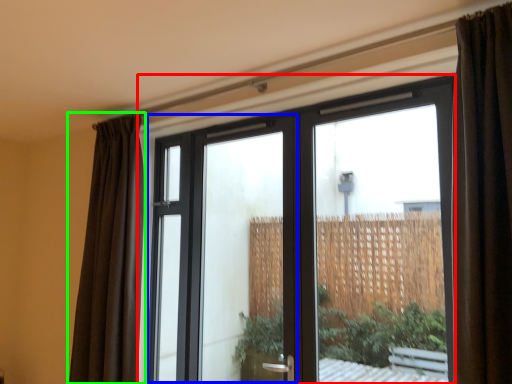
Question: Estimate the real-world distances between objects in this image. Which object is closer to window (highlighted by a red box), screen door (highlighted by a blue box) or curtain (highlighted by a green box)?

Choices:
 (A) screen door
 (B) curtain

Answer: (A)